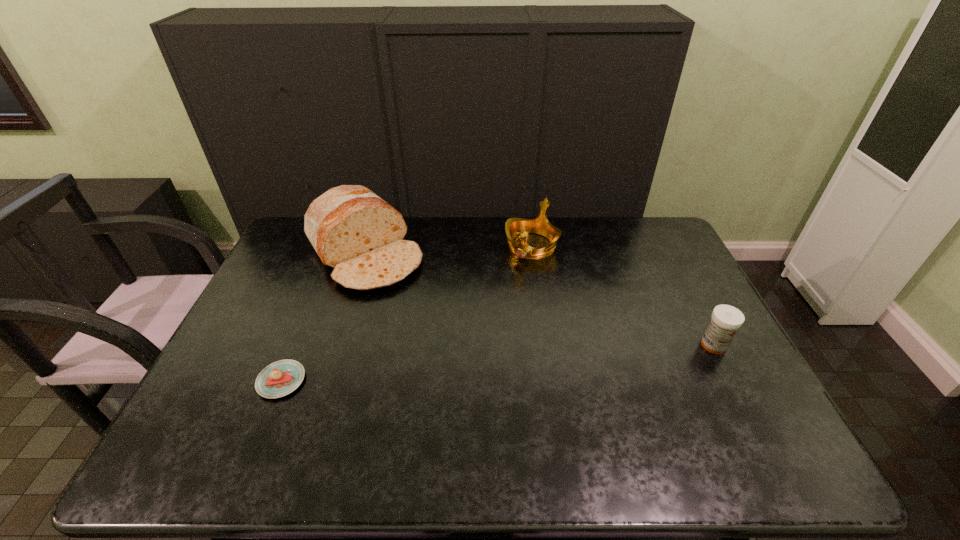
Locate an element on the screen. vacant space that satisfies the following two spatial constraints: 1. on the back side of the tiara; 2. on the left side of the nearest object is located at coordinates (336, 246).

This screenshot has width=960, height=540. I want to click on free space that satisfies the following two spatial constraints: 1. on the back side of the third farthest object; 2. on the left side of the pastry, so click(x=296, y=345).

The width and height of the screenshot is (960, 540). In order to click on free location that satisfies the following two spatial constraints: 1. on the front side of the second nearest object; 2. on the left side of the bread in this screenshot , I will do `click(336, 345)`.

I want to click on free space that satisfies the following two spatial constraints: 1. on the back side of the pastry; 2. on the right side of the third object from left to right, so click(x=336, y=246).